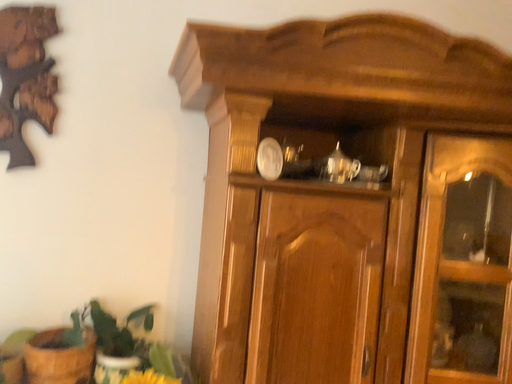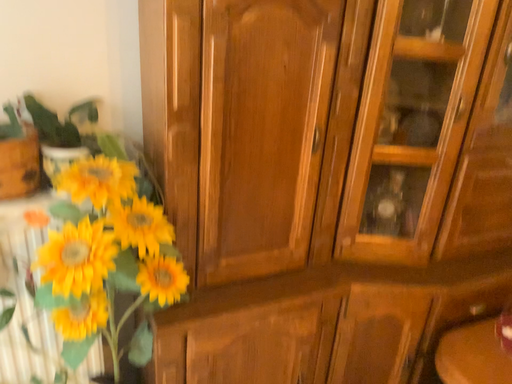
Question: How did the camera likely rotate when shooting the video?

Choices:
 (A) rotated left
 (B) rotated right

Answer: (B)